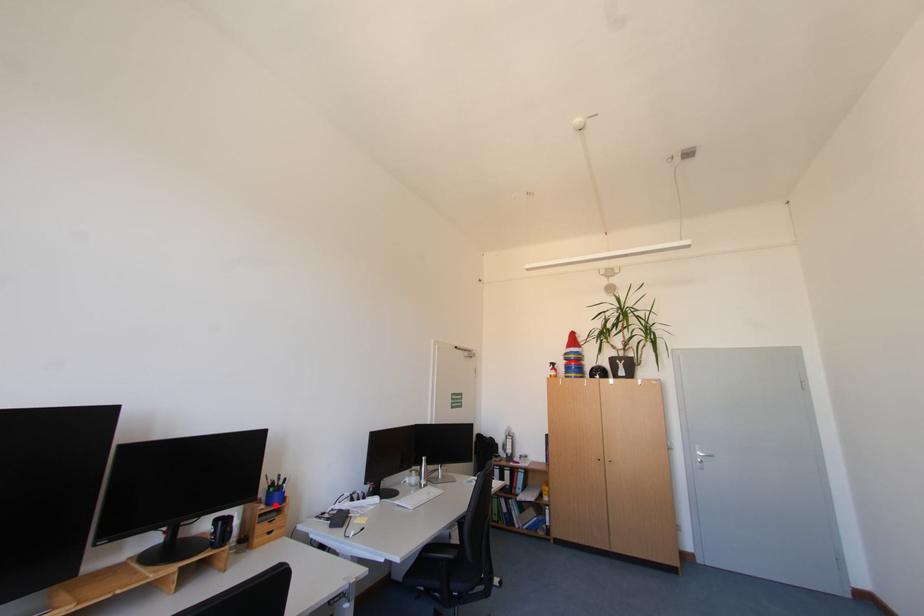
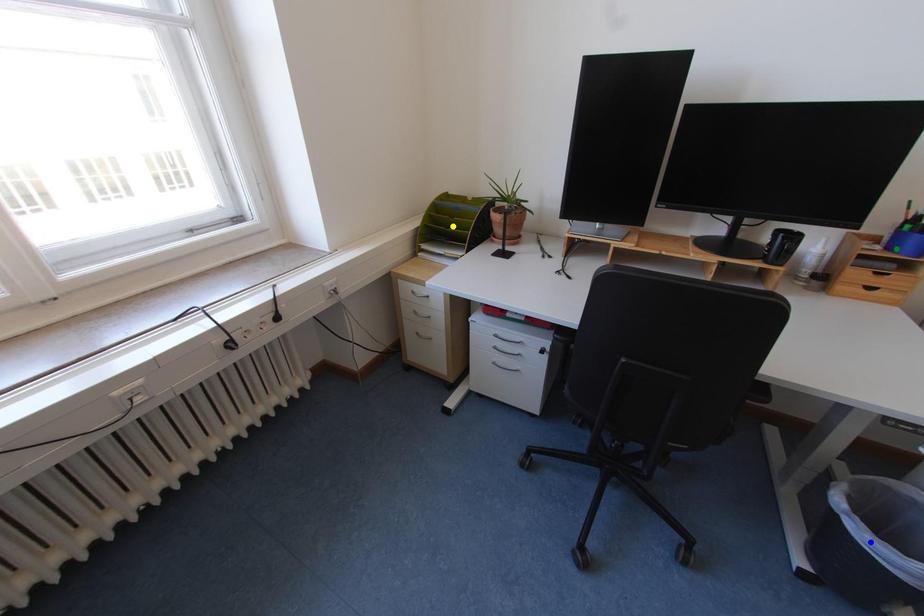
Question: I am providing you with two images of the same scene from different viewpoints. A red point is marked on the first image. You are given multiple points on the second image. Can you choose the point in image 2 that corresponds to the point in image 1?

Choices:
 (A) blue point
 (B) yellow point
 (C) green point

Answer: (C)